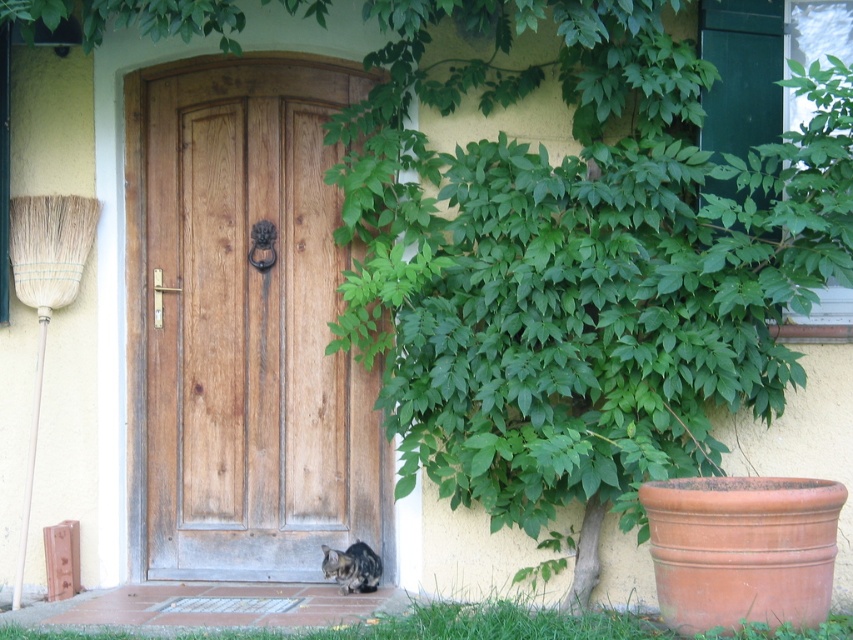
Based on the scene description, which object corresponds to the coordinates point (x=245, y=326)?

The point (x=245, y=326) corresponds to the natural wood door at center.